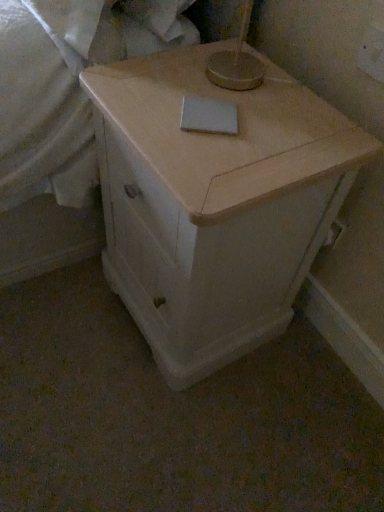
Question: From a real-world perspective, is light wood cabinet at center under white matte notepad at center?

Choices:
 (A) yes
 (B) no

Answer: (A)

Question: Is white matte notepad at center inside light wood cabinet at center?

Choices:
 (A) yes
 (B) no

Answer: (A)

Question: Is light wood cabinet at center directly adjacent to white matte notepad at center?

Choices:
 (A) no
 (B) yes

Answer: (A)

Question: Considering the relative sizes of light wood cabinet at center and white matte notepad at center in the image provided, is light wood cabinet at center thinner than white matte notepad at center?

Choices:
 (A) yes
 (B) no

Answer: (B)

Question: Does light wood cabinet at center lie in front of white matte notepad at center?

Choices:
 (A) yes
 (B) no

Answer: (A)

Question: Which is correct: white matte sheet at upper center is inside light wood cabinet at center, or outside of it?

Choices:
 (A) inside
 (B) outside

Answer: (B)

Question: Considering the positions of white matte sheet at upper center and light wood cabinet at center in the image, is white matte sheet at upper center bigger or smaller than light wood cabinet at center?

Choices:
 (A) big
 (B) small

Answer: (B)

Question: From a real-world perspective, is white matte sheet at upper center above or below light wood cabinet at center?

Choices:
 (A) below
 (B) above

Answer: (B)

Question: Would you say white matte sheet at upper center is to the left or to the right of light wood cabinet at center in the picture?

Choices:
 (A) right
 (B) left

Answer: (B)

Question: Considering their positions, is light wood cabinet at center located in front of or behind white matte notepad at center?

Choices:
 (A) behind
 (B) front

Answer: (B)

Question: Looking at their shapes, would you say light wood cabinet at center is wider or thinner than white matte notepad at center?

Choices:
 (A) thin
 (B) wide

Answer: (B)

Question: Is light wood cabinet at center inside the boundaries of white matte notepad at center, or outside?

Choices:
 (A) inside
 (B) outside

Answer: (B)

Question: Does point (117, 208) appear closer or farther from the camera than point (193, 105)?

Choices:
 (A) closer
 (B) farther

Answer: (B)

Question: From a real-world perspective, is light wood cabinet at center positioned above or below white matte sheet at upper center?

Choices:
 (A) below
 (B) above

Answer: (A)

Question: Is light wood cabinet at center to the left or to the right of white matte sheet at upper center in the image?

Choices:
 (A) left
 (B) right

Answer: (B)